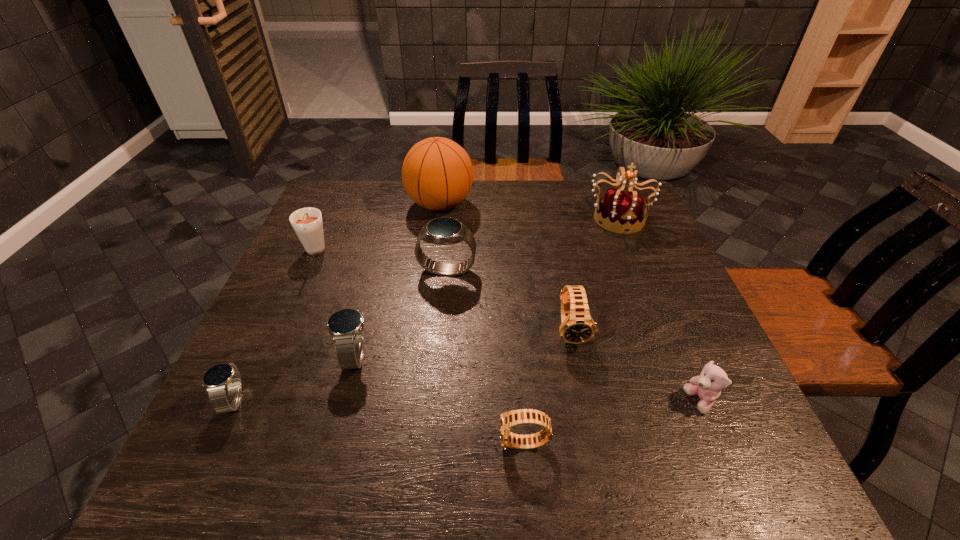
Identify the location of pink teddy bear. (708, 385).

Where is `the nearest watch`? The width and height of the screenshot is (960, 540). the nearest watch is located at coordinates (510, 419).

Where is `the nearer black watch`? The image size is (960, 540). the nearer black watch is located at coordinates (510, 419).

At what (x,y) coordinates should I click in order to perform the action: click on the leftmost blue watch. Please return your answer as a coordinate pair (x, y). Looking at the image, I should click on (x=216, y=379).

The height and width of the screenshot is (540, 960). In order to click on the leftmost watch in this screenshot , I will do `click(216, 379)`.

Identify the location of blank space located on the front of the basketball. (428, 301).

You are a GUI agent. You are given a task and a screenshot of the screen. Output one action in this format:
    pyautogui.click(x=<x>, y=<y>)
    Task: Click on the free space located 0.300m on the front-facing side of the eighth shortest object
    The width and height of the screenshot is (960, 540).
    Given the screenshot: What is the action you would take?
    pyautogui.click(x=657, y=312)

Where is `blank space located on the drink side of the root beer`? The image size is (960, 540). blank space located on the drink side of the root beer is located at coordinates (274, 346).

The width and height of the screenshot is (960, 540). I want to click on vacant region located 0.050m on the front of the rightmost blue watch, so click(x=444, y=296).

At what (x,y) coordinates should I click in order to perform the action: click on free location located on the face of the farther black watch. Please return your answer as a coordinate pair (x, y). Looking at the image, I should click on (588, 415).